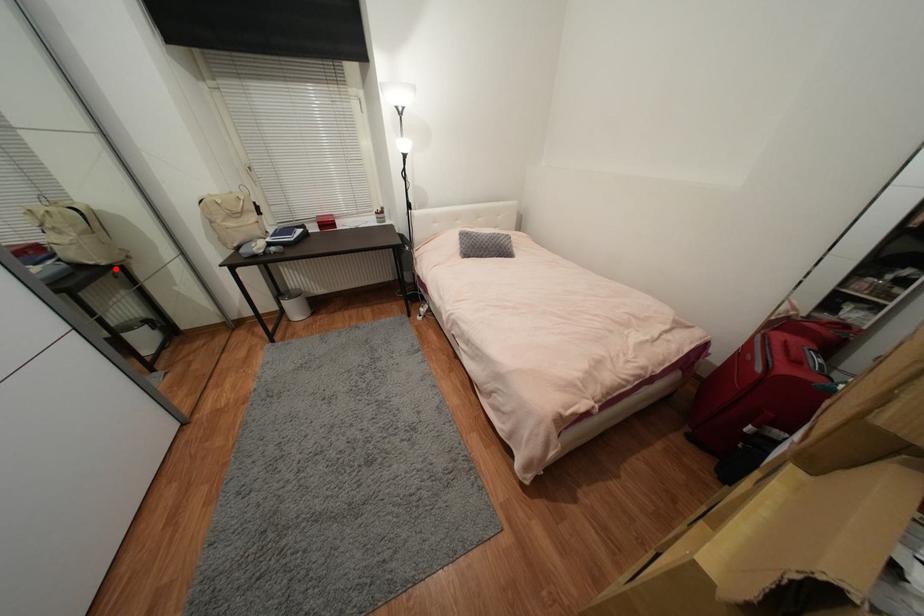
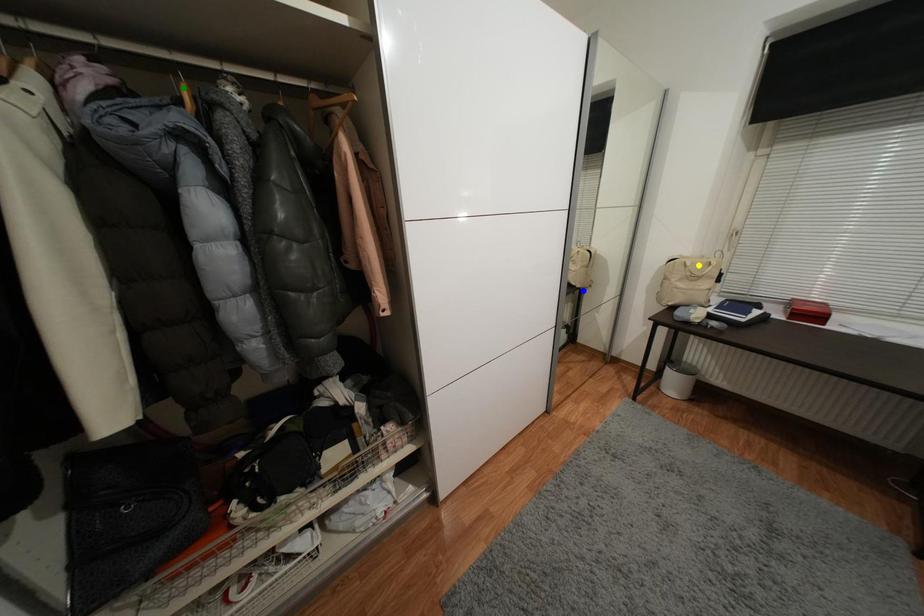
Question: I am providing you with two images of the same scene from different viewpoints. A red point is marked on the first image. You are given multiple points on the second image. Which spot in image 2 lines up with the point in image 1?

Choices:
 (A) green point
 (B) blue point
 (C) yellow point

Answer: (B)